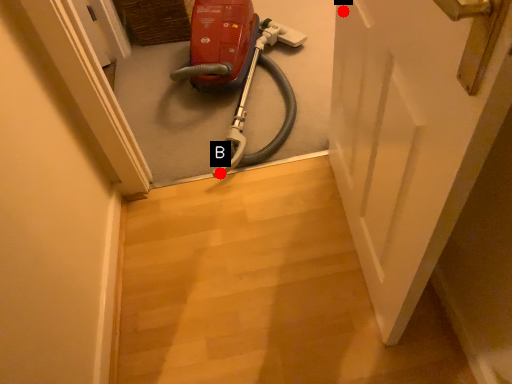
Question: Two points are circled on the image, labeled by A and B beside each circle. Which point is farther from the camera taking this photo?

Choices:
 (A) A is further
 (B) B is further

Answer: (B)